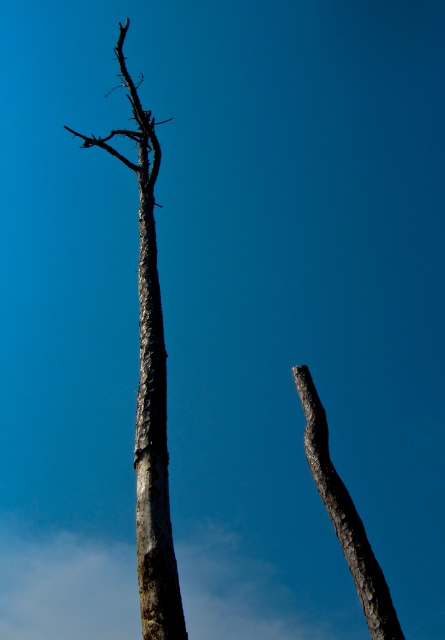
Can you confirm if gray textured trunk at center is shorter than smooth bark tree trunk at center?

No.

Does point (162, 358) come closer to viewer compared to point (140, 257)?

Yes, it is.

You are a GUI agent. You are given a task and a screenshot of the screen. Output one action in this format:
    pyautogui.click(x=<x>, y=<y>)
    Task: Click on the gray textured trunk at center
    
    Given the screenshot: What is the action you would take?
    pyautogui.click(x=149, y=387)

Is gray textured trunk at center below gray rough bark branch at center?

Yes, gray textured trunk at center is below gray rough bark branch at center.

The width and height of the screenshot is (445, 640). Find the location of `gray textured trunk at center`. gray textured trunk at center is located at coordinates (149, 387).

Is point (153, 232) farther from camera compared to point (137, 109)?

No.

What are the coordinates of `gray textured trunk at center` in the screenshot? It's located at (149, 387).

The width and height of the screenshot is (445, 640). Describe the element at coordinates (149, 387) in the screenshot. I see `gray textured trunk at center` at that location.

Is point (161, 442) closer to viewer compared to point (319, 426)?

No, it is not.

Describe the element at coordinates (149, 387) in the screenshot. I see `gray textured trunk at center` at that location.

Where is `gray textured trunk at center`? The height and width of the screenshot is (640, 445). gray textured trunk at center is located at coordinates (149, 387).